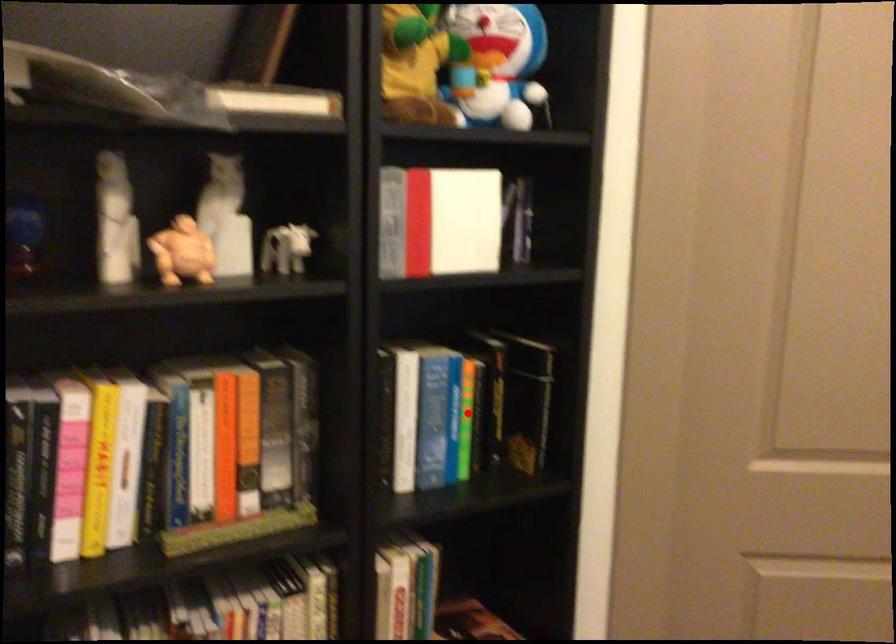
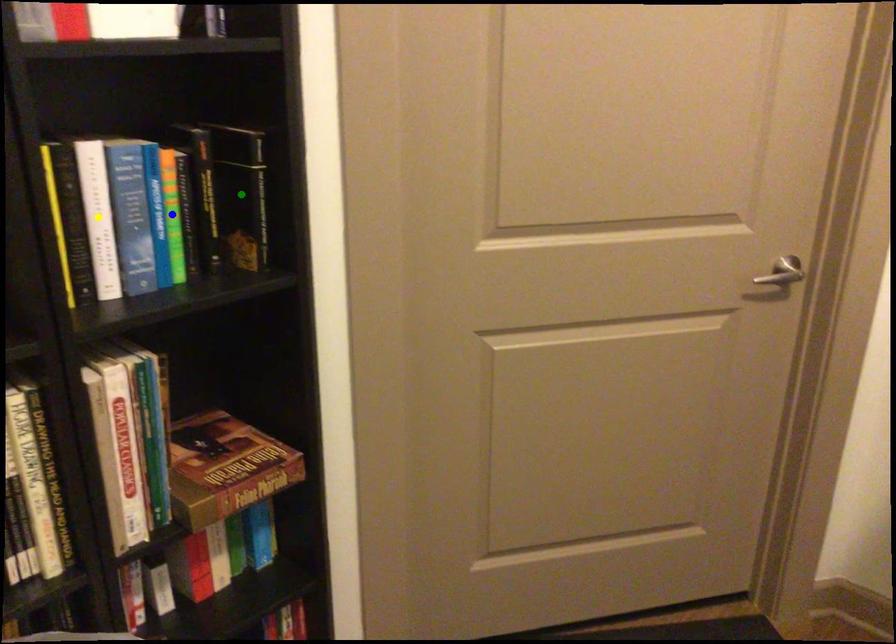
Question: I am providing you with two images of the same scene from different viewpoints. A red point is marked on the first image. You are given multiple points on the second image. Which spot in image 2 lines up with the point in image 1?

Choices:
 (A) yellow point
 (B) blue point
 (C) green point

Answer: (B)